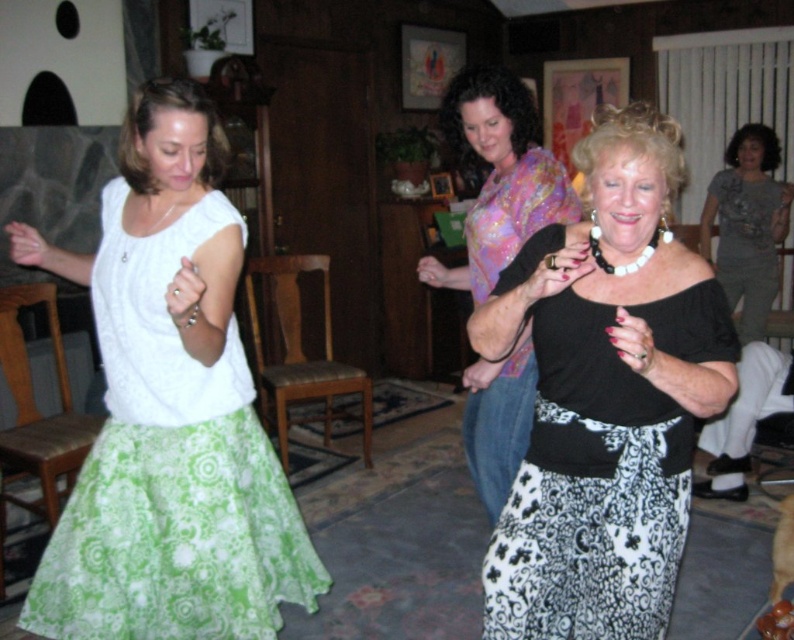
You are a photographer standing in the living room and want to take a photo of the black matte skirt at center and the floral silk blouse at center. If your camera can only capture objects within 16 inches of each other, will both items be in the same frame?

The distance between the black matte skirt at center and the floral silk blouse at center is 16.40 inches. Since the camera requires objects to be within 16 inches, they are slightly too far apart to be captured together in the same frame.

Based on the scene described, which object is positioned to the left of the other between the white lace blouse at left and the gray matte shirt at upper right?

The white lace blouse at left is positioned to the left of the gray matte shirt at upper right.

You are a photographer planning to take a group photo of the women in the scene. You want to ensure that both the white lace blouse at left and the floral silk blouse at center are fully visible in the frame. Given their widths, which blouse should you position closer to the camera to maintain their visibility?

The white lace blouse at left is wider than the floral silk blouse at center. To ensure both are fully visible, position the wider white lace blouse at left closer to the camera. This way, even though it is larger, its closer proximity will help it fit within the frame without overlapping the other subject.